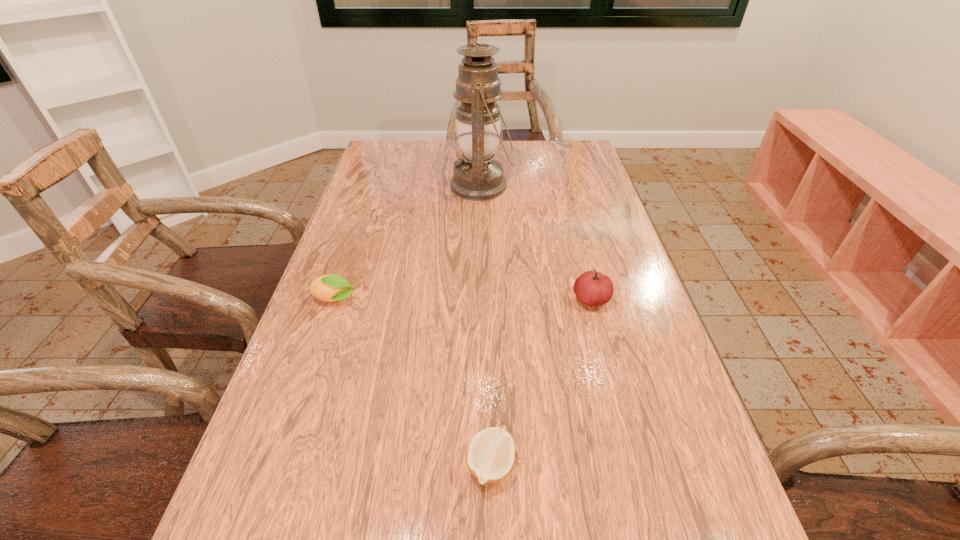
Where is `vacant space that satisfies the following two spatial constraints: 1. with leaves positioned above the left lemon; 2. on the left side of the rightmost object`? vacant space that satisfies the following two spatial constraints: 1. with leaves positioned above the left lemon; 2. on the left side of the rightmost object is located at coordinates pyautogui.click(x=335, y=300).

You are a GUI agent. You are given a task and a screenshot of the screen. Output one action in this format:
    pyautogui.click(x=<x>, y=<y>)
    Task: Click on the free point that satisfies the following two spatial constraints: 1. with leaves positioned above the third tallest object; 2. on the right side of the shorter lemon
    
    Given the screenshot: What is the action you would take?
    pyautogui.click(x=277, y=465)

This screenshot has width=960, height=540. What are the coordinates of `free location that satisfies the following two spatial constraints: 1. on the back side of the shortest object; 2. with leaves positioned above the second shortest object` in the screenshot? It's located at (488, 300).

This screenshot has width=960, height=540. Identify the location of free region that satisfies the following two spatial constraints: 1. with leaves positioned above the left lemon; 2. on the back side of the nearest object. (277, 465).